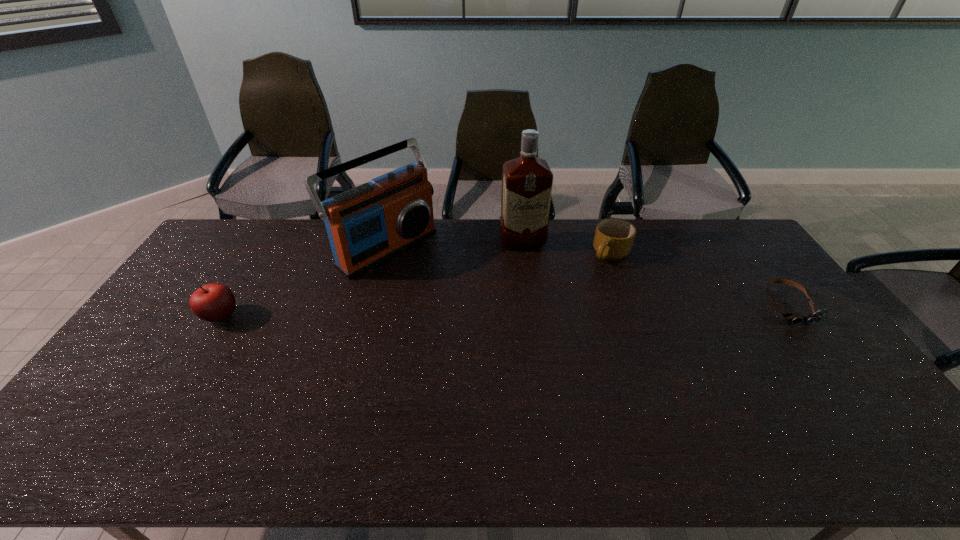
You are a GUI agent. You are given a task and a screenshot of the screen. Output one action in this format:
    pyautogui.click(x=<x>, y=<y>)
    Task: Click on the apple
    Image resolution: width=960 pixels, height=540 pixels.
    Given the screenshot: What is the action you would take?
    pyautogui.click(x=214, y=302)

Find the location of `goggles`. goggles is located at coordinates pos(815,317).

I want to click on the rightmost object, so click(x=815, y=317).

Identify the location of the fourth shortest object. The image size is (960, 540). (373, 222).

Where is `the fourth object from right to left`? The image size is (960, 540). the fourth object from right to left is located at coordinates (373, 222).

Where is `the second shortest object`? the second shortest object is located at coordinates (613, 238).

Find the location of a particular element. The image size is (960, 540). mug is located at coordinates (613, 238).

Find the location of a particular element. the third object from left to right is located at coordinates pos(527,181).

This screenshot has height=540, width=960. In order to click on the tallest object in this screenshot , I will do `click(527, 181)`.

Locate an element on the screen. The image size is (960, 540). vacant area located on the front of the leftmost object is located at coordinates (189, 368).